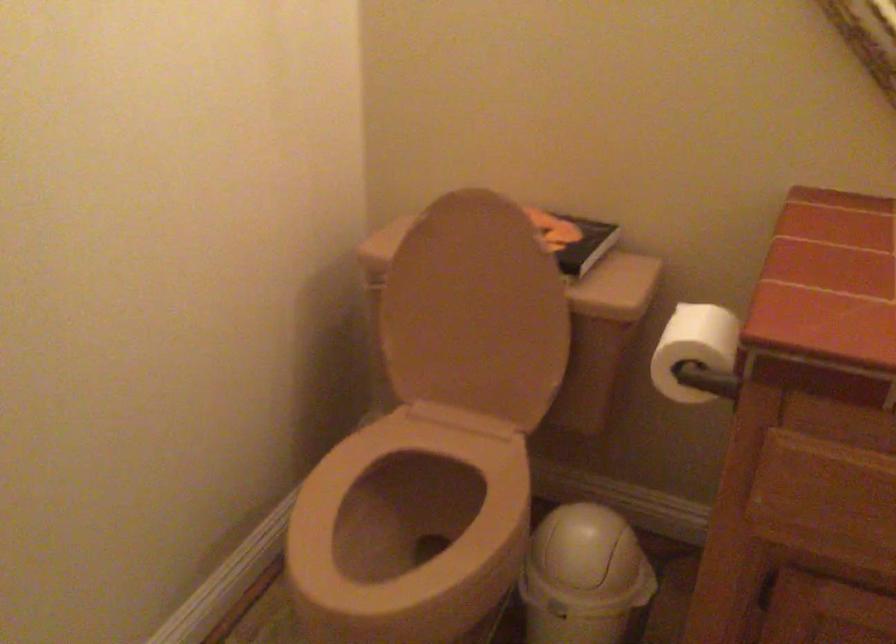
Based on the continuous images, in which direction is the camera rotating?

The camera's rotation is toward right-down.